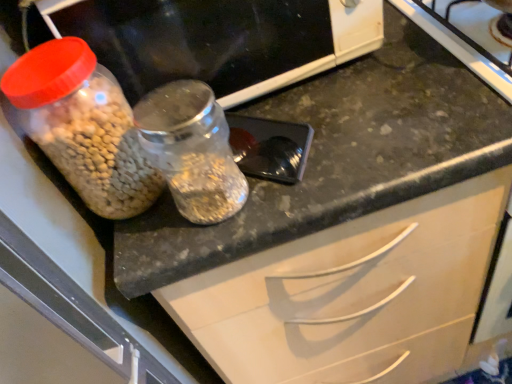
Image resolution: width=512 pixels, height=384 pixels. In order to click on vacant space that is to the left of transparent glass jar at center in this screenshot , I will do `click(150, 238)`.